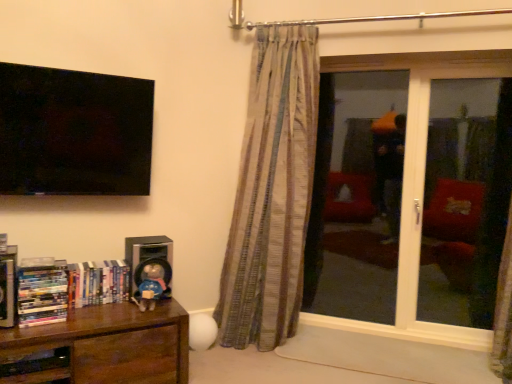
Question: Is hardcover books at left, the 1th book viewed from the right, at the back of brown wood bookcase at lower left?

Choices:
 (A) no
 (B) yes

Answer: (A)

Question: From a real-world perspective, is brown wood bookcase at lower left physically above hardcover books at left, the 1th book viewed from the right?

Choices:
 (A) no
 (B) yes

Answer: (A)

Question: Would you say brown wood bookcase at lower left is outside hardcover books at left, the 1th book viewed from the right?

Choices:
 (A) yes
 (B) no

Answer: (A)

Question: Is there a large distance between brown wood bookcase at lower left and hardcover books at left, marked as the 3th book in a left-to-right arrangement?

Choices:
 (A) no
 (B) yes

Answer: (A)

Question: From a real-world perspective, is brown wood bookcase at lower left positioned under hardcover books at left, the 1th book viewed from the right, based on gravity?

Choices:
 (A) yes
 (B) no

Answer: (A)

Question: From the image's perspective, is brown wood bookcase at lower left positioned above or below transparent glass door at right?

Choices:
 (A) above
 (B) below

Answer: (B)

Question: Would you say brown wood bookcase at lower left is inside or outside transparent glass door at right?

Choices:
 (A) outside
 (B) inside

Answer: (A)

Question: From a real-world perspective, is brown wood bookcase at lower left physically located above or below transparent glass door at right?

Choices:
 (A) above
 (B) below

Answer: (B)

Question: In the image, is brown wood bookcase at lower left positioned in front of or behind transparent glass door at right?

Choices:
 (A) behind
 (B) front

Answer: (B)

Question: From the image's perspective, relative to transparent glass door at right, is matte blue plush at lower left above or below?

Choices:
 (A) above
 (B) below

Answer: (B)

Question: From a real-world perspective, is matte blue plush at lower left physically located above or below transparent glass door at right?

Choices:
 (A) below
 (B) above

Answer: (A)

Question: In terms of height, does matte blue plush at lower left look taller or shorter compared to transparent glass door at right?

Choices:
 (A) short
 (B) tall

Answer: (A)

Question: Is matte blue plush at lower left inside the boundaries of transparent glass door at right, or outside?

Choices:
 (A) outside
 (B) inside

Answer: (A)

Question: Is brown wood bookcase at lower left inside the boundaries of hardcover book at left, positioned as the first book in left-to-right order, or outside?

Choices:
 (A) outside
 (B) inside

Answer: (A)

Question: From a real-world perspective, is brown wood bookcase at lower left above or below hardcover book at left, positioned as the first book in left-to-right order?

Choices:
 (A) above
 (B) below

Answer: (B)